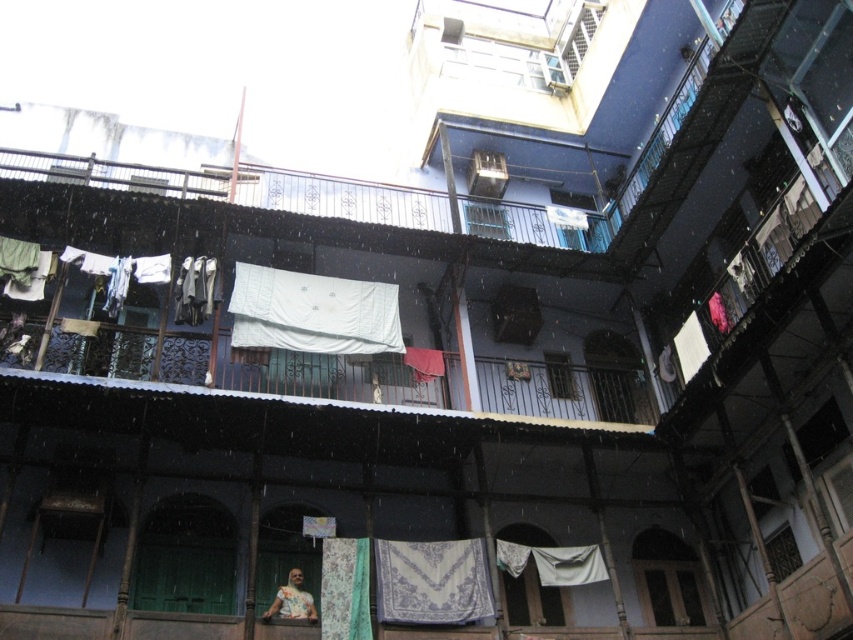
This screenshot has height=640, width=853. Describe the element at coordinates (312, 312) in the screenshot. I see `white fabric at center` at that location.

Where is `white fabric at center`? white fabric at center is located at coordinates (312, 312).

Which is behind, point (379, 296) or point (314, 611)?

Point (379, 296)

Where is `white fabric at center`? The image size is (853, 640). white fabric at center is located at coordinates (312, 312).

Does point (474, 602) come closer to viewer compared to point (271, 616)?

That is False.

Does blue textured fabric at center have a smaller size compared to printed fabric woman at lower center?

Incorrect, blue textured fabric at center is not smaller in size than printed fabric woman at lower center.

Find the location of `blue textured fabric at center`. blue textured fabric at center is located at coordinates (432, 580).

Can you confirm if white fabric at center is taller than blue textured fabric at center?

Correct, white fabric at center is much taller as blue textured fabric at center.

Is white fabric at center below blue textured fabric at center?

No.

Does point (384, 305) lie in front of point (436, 602)?

That is False.

Find the location of a particular element. This screenshot has width=853, height=640. white fabric at center is located at coordinates (312, 312).